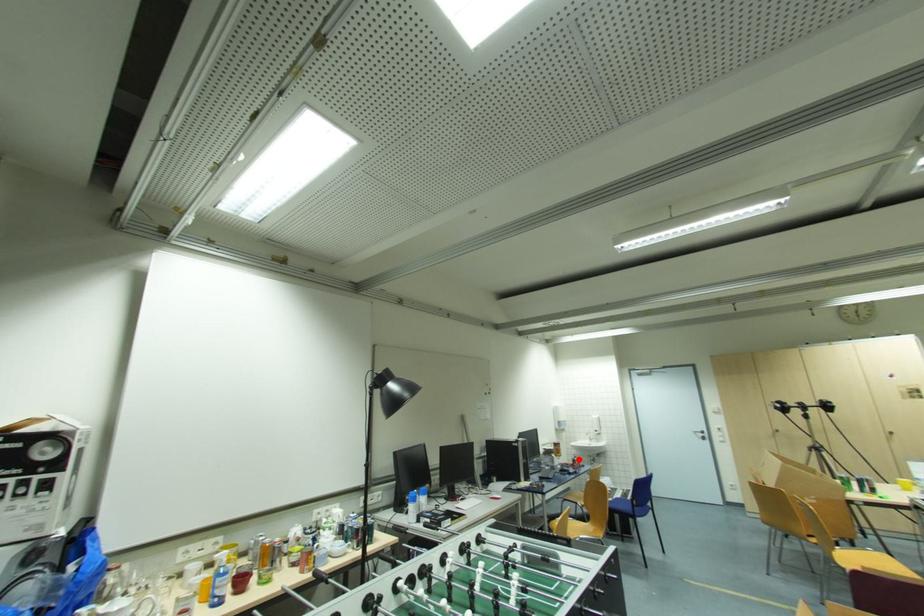
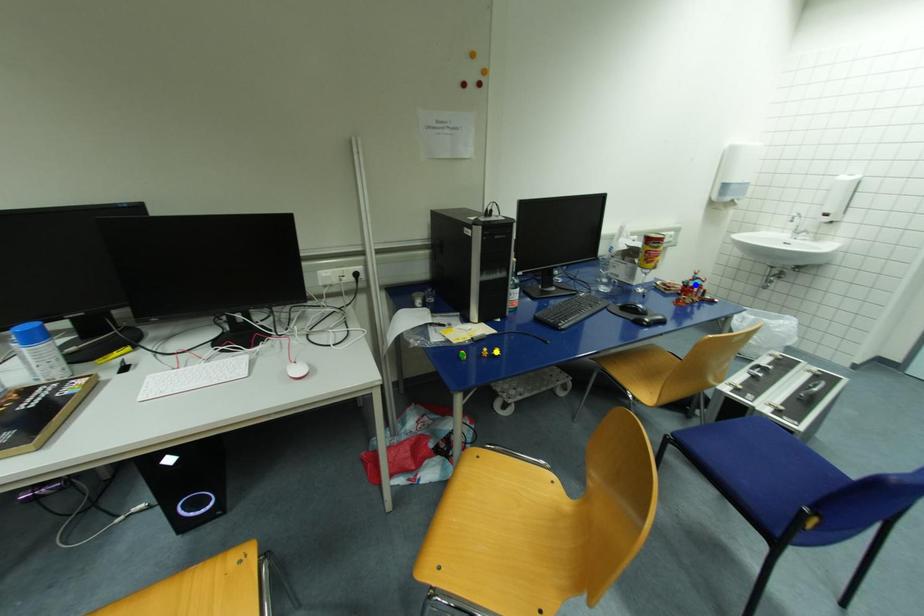
Question: I am providing you with two images of the same scene from different viewpoints. A red point is marked on the first image. You are given multiple points on the second image. Which point in image 2 is actually the same real-world point as the red point in image 1?

Choices:
 (A) green point
 (B) yellow point
 (C) blue point

Answer: (C)